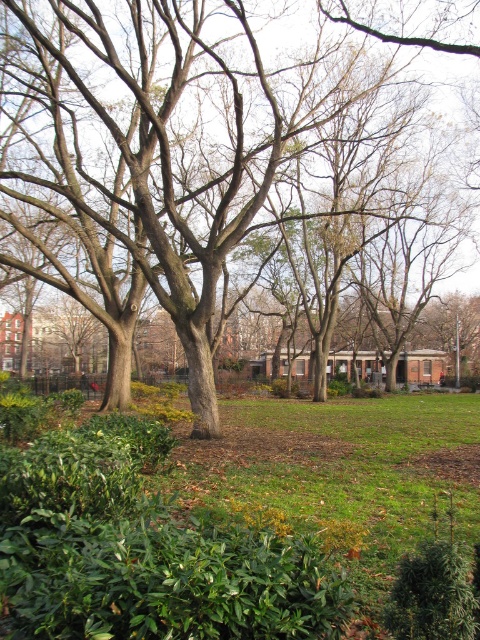
You are a gardener standing in the park and need to water the green leafy shrubs at lower left and the brown rough tree at center. Since you can only water one at a time, which one should you water first if you want to reach it without walking through the other?

You should water the green leafy shrubs at lower left first because it is in front of the brown rough tree at center, so you can reach it without needing to walk through the tree.

You are a gardener planning to trim the green leafy shrubs at lower left and the brown rough tree at center. Which object requires more effort to trim due to its size?

The brown rough tree at center requires more effort to trim because it is thicker than the green leafy shrubs at lower left.

You are standing in the park and want to take a photo that includes both the point at coordinates point (x=149, y=621) and the point at coordinates point (x=192, y=35). Which point should you position closer to the camera to ensure both are in focus?

Point point (x=149, y=621) is closer to the camera than point point (x=192, y=35). To ensure both are in focus, position the camera closer to point point (x=149, y=621) since it is nearer and adjust the focus accordingly.